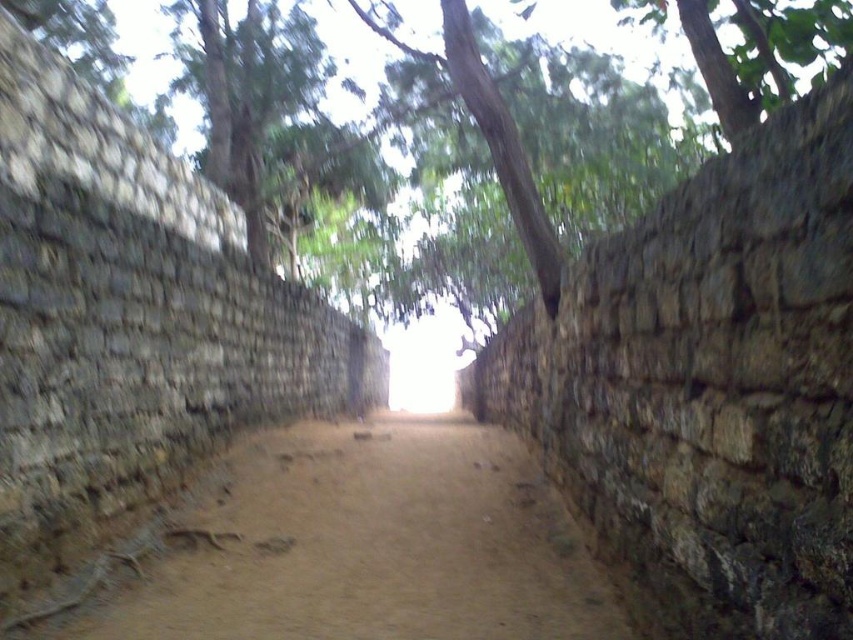
Question: Which point is closer to the camera?

Choices:
 (A) green leafy tree at upper center
 (B) brown sandy dirt track at center

Answer: (B)

Question: Is brown sandy dirt track at center positioned in front of green leafy tree at upper center?

Choices:
 (A) no
 (B) yes

Answer: (B)

Question: From the image, what is the correct spatial relationship of brown sandy dirt track at center in relation to green leafy tree at upper center?

Choices:
 (A) left
 (B) right

Answer: (B)

Question: Which of the following is the closest to the observer?

Choices:
 (A) brown sandy dirt track at center
 (B) green leafy tree at upper center

Answer: (A)

Question: Can you confirm if brown sandy dirt track at center is positioned above green leafy tree at upper center?

Choices:
 (A) no
 (B) yes

Answer: (A)